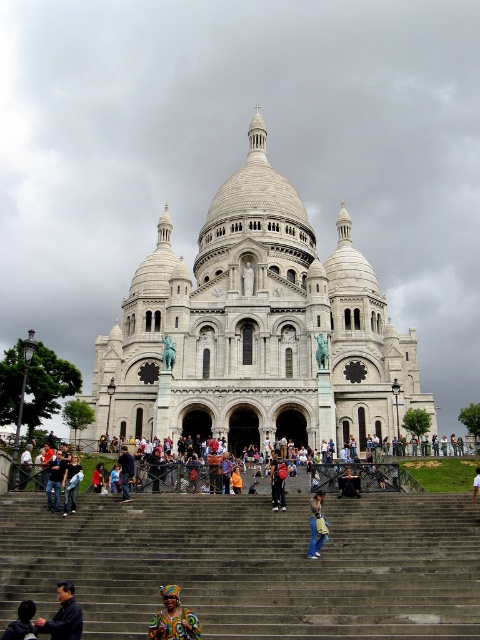
Question: Which point is farther to the camera?

Choices:
 (A) (50, 577)
 (B) (12, 637)
 (C) (122, 486)

Answer: (C)

Question: Which point is farther from the camera taking this photo?

Choices:
 (A) (72, 636)
 (B) (165, 616)
 (C) (232, 566)
 (D) (310, 541)

Answer: (D)

Question: Is printed fabric headscarf at center below light brown leather jacket at center?

Choices:
 (A) yes
 (B) no

Answer: (A)

Question: Is dark blue shirt at lower left above multicolored fabric bag at center?

Choices:
 (A) yes
 (B) no

Answer: (B)

Question: Considering the relative positions of white stone church at center and dark blue shirt at lower left in the image provided, where is white stone church at center located with respect to dark blue shirt at lower left?

Choices:
 (A) below
 (B) above

Answer: (B)

Question: Which object appears closest to the camera in this image?

Choices:
 (A) denim jacket at lower center
 (B) light brown leather jacket at center
 (C) multicolored fabric bag at center

Answer: (A)